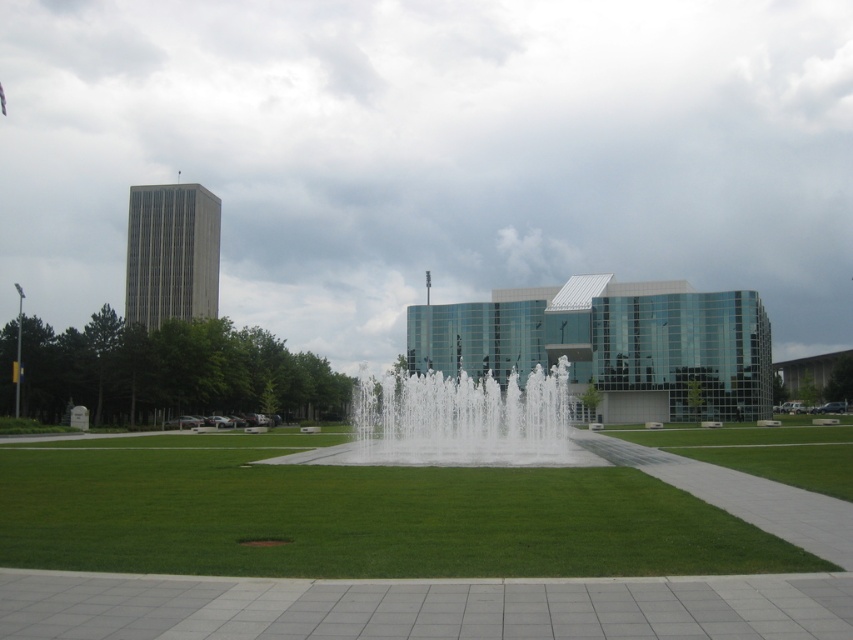
You are a landscape architect evaluating the urban space in the image. You need to determine which area is smaller in size between the green grass at center and the white water at center. Which one is smaller?

The green grass at center has a smaller size compared to the white water at center, so the green grass at center is smaller.

You are standing at the paved walkway in the foreground of the scene. Which direction should you walk to reach the green grass at center?

The green grass at center is located at point coordinates, so you should walk towards the center of the scene from the paved walkway in the foreground to reach it.